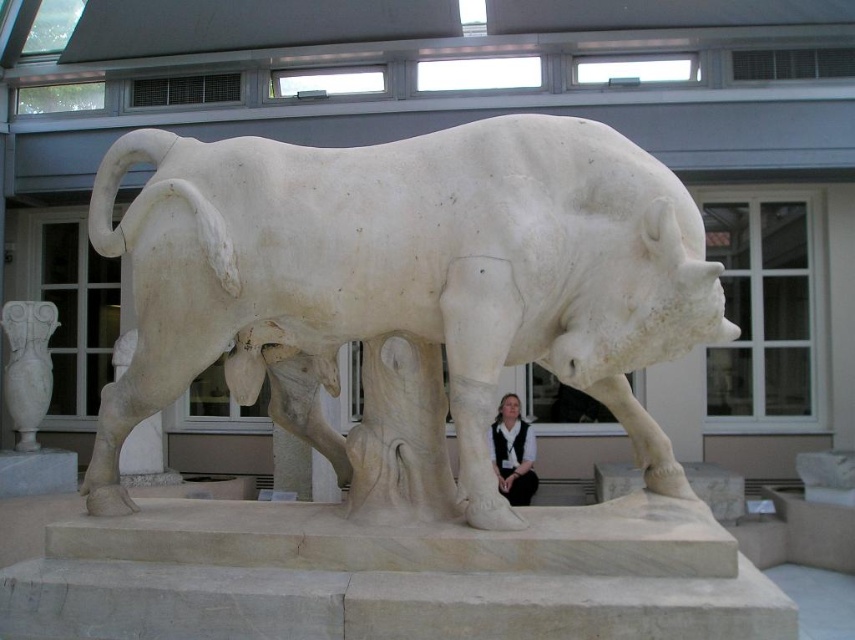
You are an art curator planning to move the white marble vase at left closer to the bull sculpture. Given their current positions, can you determine if the vase will be placed to the left or right of the bull after moving it?

The white marble vase at left is currently located at point (x=27, y=365). Since the bull sculpture is the central object in the scene, moving the vase closer to it would position the vase to the left side of the bull sculpture.

You are an art curator planning to move the white marble bull at center and the white marble vase at left to a new exhibition space. The entrance of the new space has a height restriction of 2 meters. Can both objects pass through without any modifications?

The white marble bull at center is taller than the white marble vase at left. Since the height restriction is 2 meters, we need to know the exact height of the bull to determine if it can pass. However, the information provided only states that the bull is taller than the vase. Without specific measurements, we cannot confirm if the bull is under 2 meters. Therefore, it is uncertain if both objects can pass through the entrance without modifications.

You are a museum security guard and need to move a 4.5 meter long ladder from the entrance to a storage room located behind the white marble sculpture of a bull. The entrance is near the point at coordinates point [382,262]. Can you safely maneuver the ladder around the sculpture without hitting it?

The distance between the entrance at point [382,262] and the sculpture is 3.98 meters. Since the ladder is 4.5 meters long, which is longer than the available space, you cannot safely maneuver the ladder around the sculpture without hitting it.